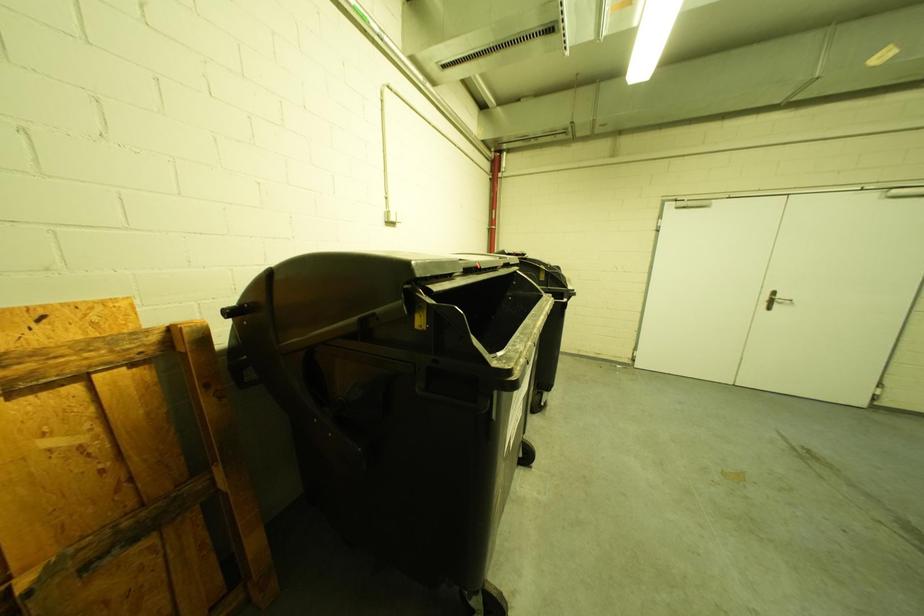
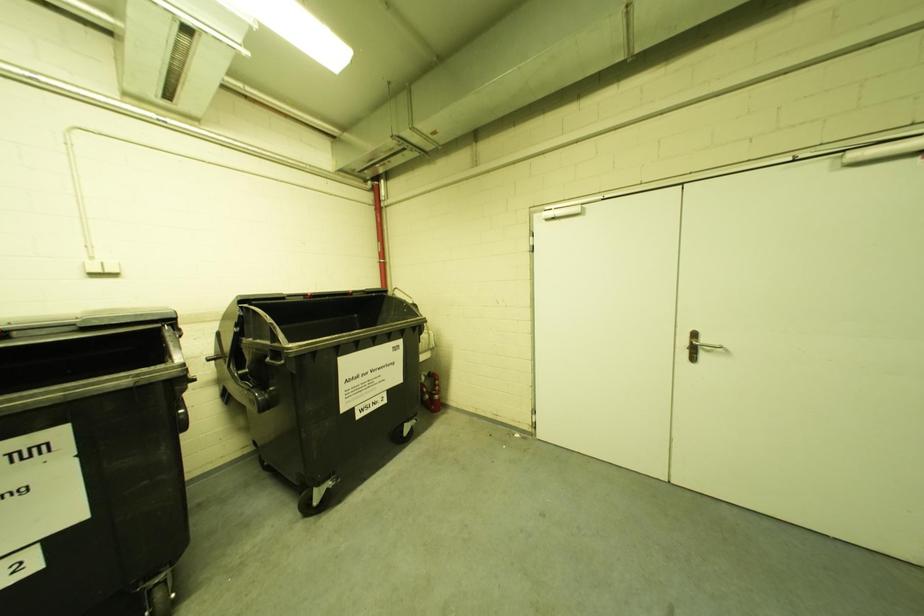
Question: In a continuous first-person perspective shot, in which direction is the camera moving?

Choices:
 (A) Left
 (B) Right
 (C) Forward
 (D) Backward

Answer: (B)